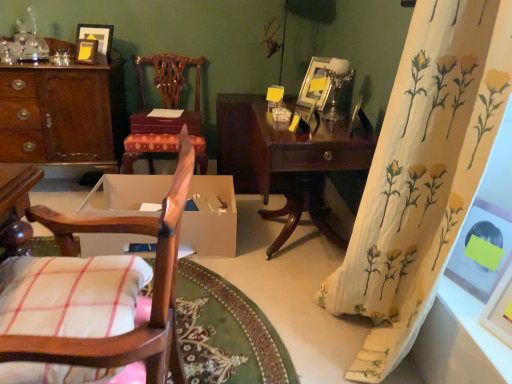
At what (x,y) coordinates should I click in order to perform the action: click on vacant area that is in front of wooden picture frame at upper left, which is the 2th picture frame in back-to-front order. Please return your answer as a coordinate pair (x, y). Looking at the image, I should click on (79, 67).